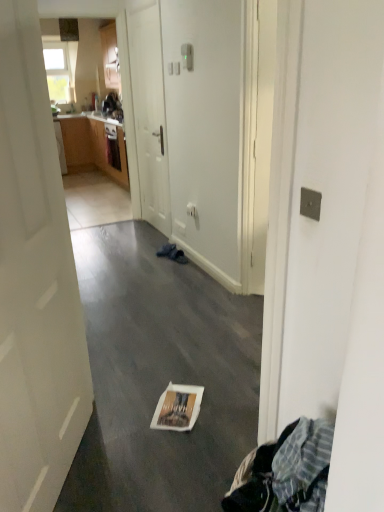
Locate an element on the screen. This screenshot has height=512, width=384. vacant space to the left of white glossy magazine at center is located at coordinates (123, 404).